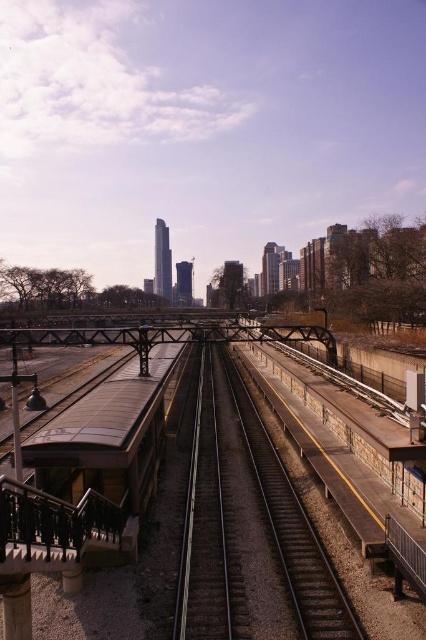
Question: Does concrete platform at center lie in front of brown wooden passenger train at left?

Choices:
 (A) yes
 (B) no

Answer: (B)

Question: Which of these objects is positioned closest to the brown wooden passenger train at left?

Choices:
 (A) concrete platform at center
 (B) smooth steel tracks at center

Answer: (A)

Question: From the image, what is the correct spatial relationship of smooth steel tracks at center in relation to brown wooden passenger train at left?

Choices:
 (A) below
 (B) above

Answer: (A)

Question: Can you confirm if smooth steel tracks at center is bigger than brown wooden passenger train at left?

Choices:
 (A) yes
 (B) no

Answer: (B)

Question: Among these points, which one is farthest from the camera?

Choices:
 (A) pyautogui.click(x=316, y=573)
 (B) pyautogui.click(x=146, y=360)

Answer: (B)

Question: Which point is closer to the camera?

Choices:
 (A) smooth steel tracks at center
 (B) concrete platform at center

Answer: (B)